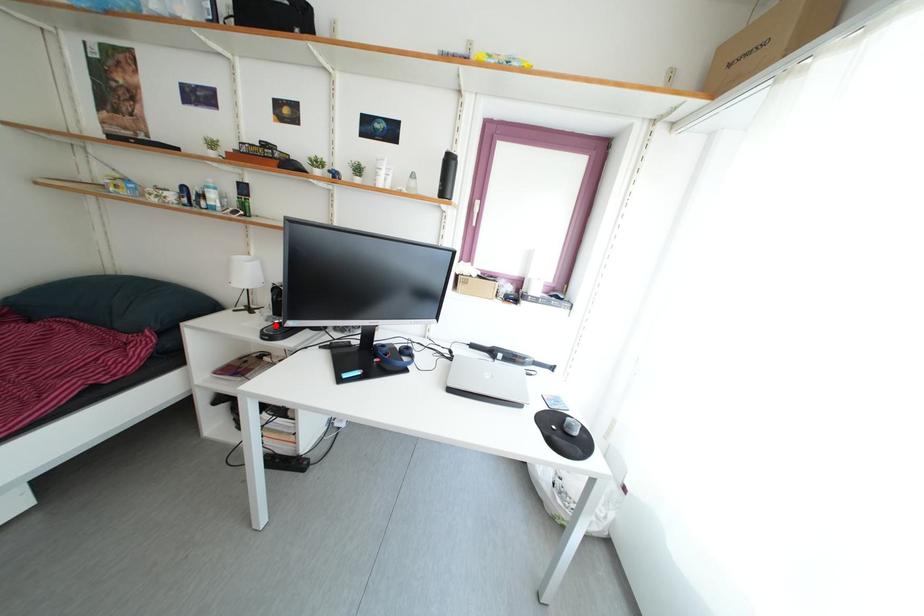
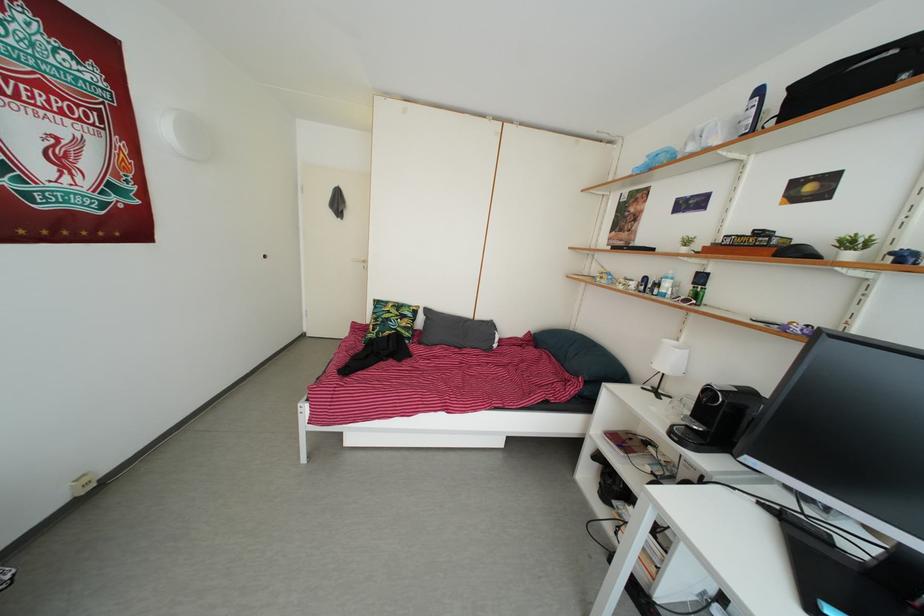
The point at the highlighted location is marked in the first image. Where is the corresponding point in the second image?

(691, 424)